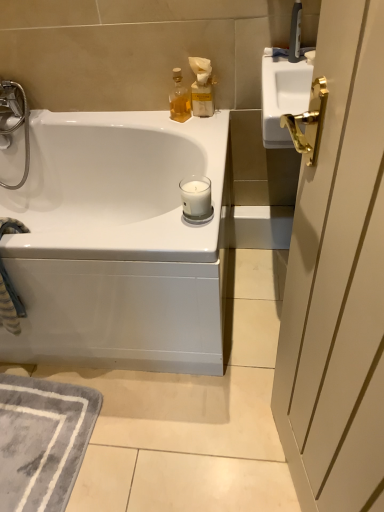
This screenshot has width=384, height=512. Find the location of `free region on the left part of white glass candle at center`. free region on the left part of white glass candle at center is located at coordinates (147, 229).